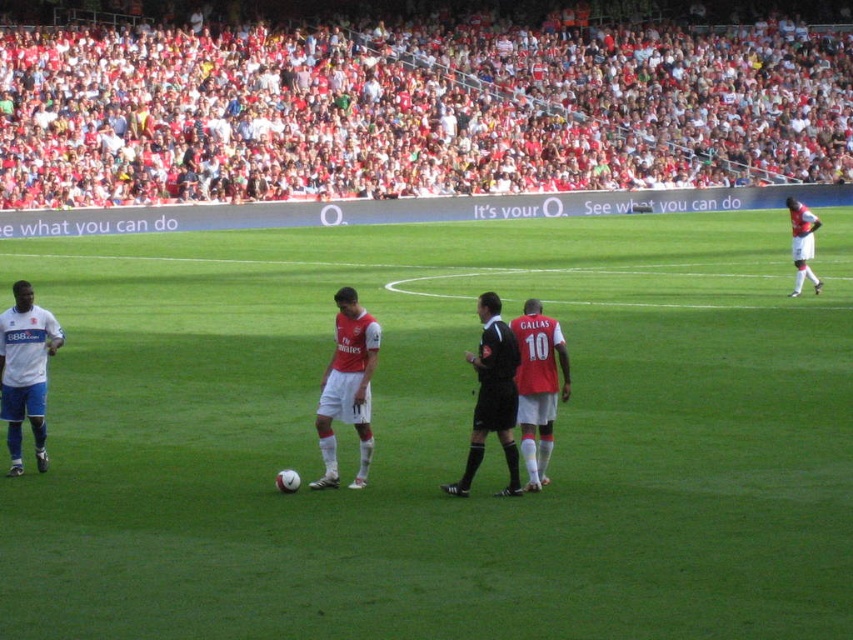
Question: Which of the following is the closest to the observer?

Choices:
 (A) (21, 332)
 (B) (351, 364)

Answer: (B)

Question: Based on their relative distances, which object is farther from the matte red jersey at center?

Choices:
 (A) red fabric crowd at upper center
 (B) white matte jersey at left
 (C) green grass field at center

Answer: (A)

Question: Is green grass field at center bigger than black jersey at center?

Choices:
 (A) no
 (B) yes

Answer: (B)

Question: Is green grass field at center positioned before matte red jersey at center?

Choices:
 (A) yes
 (B) no

Answer: (A)

Question: Which is farther from the white matte jersey at left?

Choices:
 (A) black jersey at center
 (B) green grass field at center
 (C) red fabric crowd at upper center

Answer: (C)

Question: Does red fabric crowd at upper center have a larger size compared to matte red jersey at center?

Choices:
 (A) no
 (B) yes

Answer: (B)